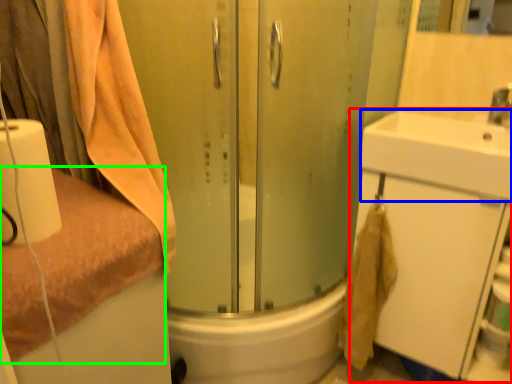
Question: Considering the real-world distances, which object is farthest from bathroom cabinet (highlighted by a red box)? sink (highlighted by a blue box) or towel (highlighted by a green box)?

Choices:
 (A) sink
 (B) towel

Answer: (B)